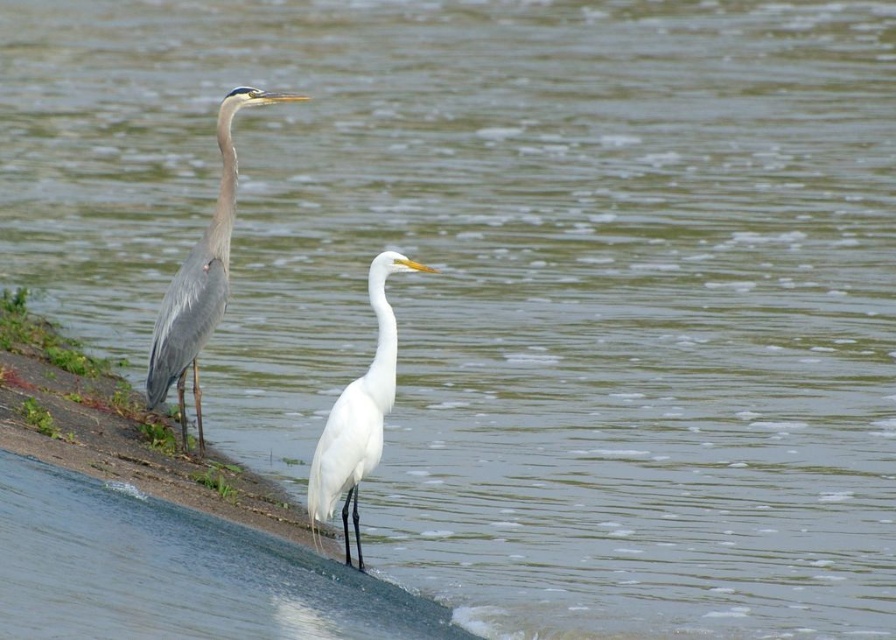
Consider the image. Can you confirm if gray matte heron at left is smaller than white smooth heron at center?

No.

Consider the image. Does gray matte heron at left have a greater width compared to white smooth heron at center?

Indeed, gray matte heron at left has a greater width compared to white smooth heron at center.

You are a GUI agent. You are given a task and a screenshot of the screen. Output one action in this format:
    pyautogui.click(x=<x>, y=<y>)
    Task: Click on the gray matte heron at left
    This screenshot has height=640, width=896.
    Given the screenshot: What is the action you would take?
    pyautogui.click(x=200, y=280)